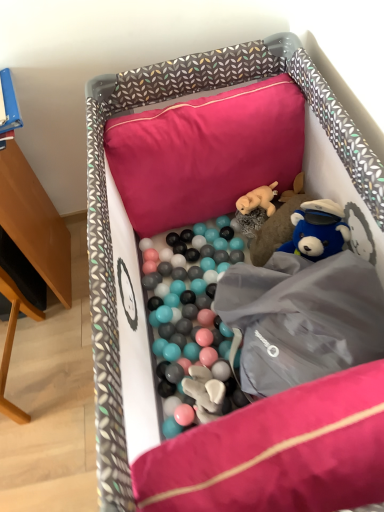
Question: Is pink fabric pillow at upper center closer to camera compared to fuzzy beige dog at center, acting as the second toy starting from the bottom?

Choices:
 (A) no
 (B) yes

Answer: (B)

Question: Is pink fabric pillow at upper center thinner than fuzzy beige dog at center, acting as the second toy starting from the bottom?

Choices:
 (A) yes
 (B) no

Answer: (B)

Question: Is pink fabric pillow at upper center positioned far away from fuzzy beige dog at center, acting as the second toy starting from the bottom?

Choices:
 (A) no
 (B) yes

Answer: (A)

Question: Does pink fabric pillow at upper center appear on the left side of fuzzy beige dog at center, which is counted as the 1th toy, starting from the top?

Choices:
 (A) no
 (B) yes

Answer: (B)

Question: Is the depth of pink fabric pillow at upper center greater than that of fuzzy beige dog at center, which is counted as the 1th toy, starting from the top?

Choices:
 (A) yes
 (B) no

Answer: (B)

Question: Is pink fabric pillow at upper center not within fuzzy beige dog at center, acting as the second toy starting from the bottom?

Choices:
 (A) no
 (B) yes

Answer: (B)

Question: Does fluffy plush bear at center, which appears as the second toy when viewed from the top, appear on the right side of soft fabric playpen at center?

Choices:
 (A) no
 (B) yes

Answer: (B)

Question: Would you say soft fabric playpen at center is part of fluffy plush bear at center, which appears as the second toy when viewed from the top,'s contents?

Choices:
 (A) no
 (B) yes

Answer: (A)

Question: Can you confirm if fluffy plush bear at center, which appears as the second toy when viewed from the top, is smaller than soft fabric playpen at center?

Choices:
 (A) no
 (B) yes

Answer: (B)

Question: Is fluffy plush bear at center, acting as the 1th toy starting from the bottom, not close to soft fabric playpen at center?

Choices:
 (A) yes
 (B) no

Answer: (B)

Question: Considering the relative sizes of fluffy plush bear at center, which appears as the second toy when viewed from the top, and soft fabric playpen at center in the image provided, is fluffy plush bear at center, which appears as the second toy when viewed from the top, shorter than soft fabric playpen at center?

Choices:
 (A) no
 (B) yes

Answer: (B)

Question: From a real-world perspective, is fluffy plush bear at center, acting as the 1th toy starting from the bottom, positioned over soft fabric playpen at center based on gravity?

Choices:
 (A) no
 (B) yes

Answer: (A)

Question: Can you confirm if fuzzy beige dog at center, acting as the second toy starting from the bottom, is positioned to the left of pink fabric pillow at upper center?

Choices:
 (A) no
 (B) yes

Answer: (A)